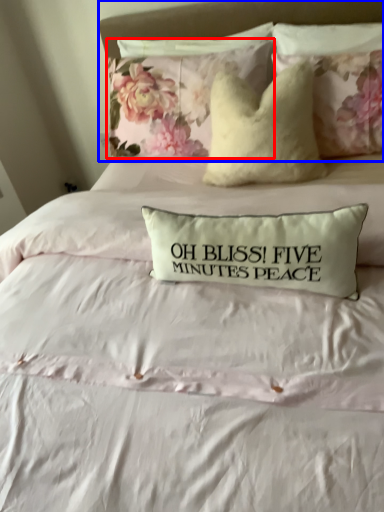
Question: Which point is closer to the camera, pillow (highlighted by a red box) or headboard (highlighted by a blue box)?

Choices:
 (A) pillow
 (B) headboard

Answer: (B)